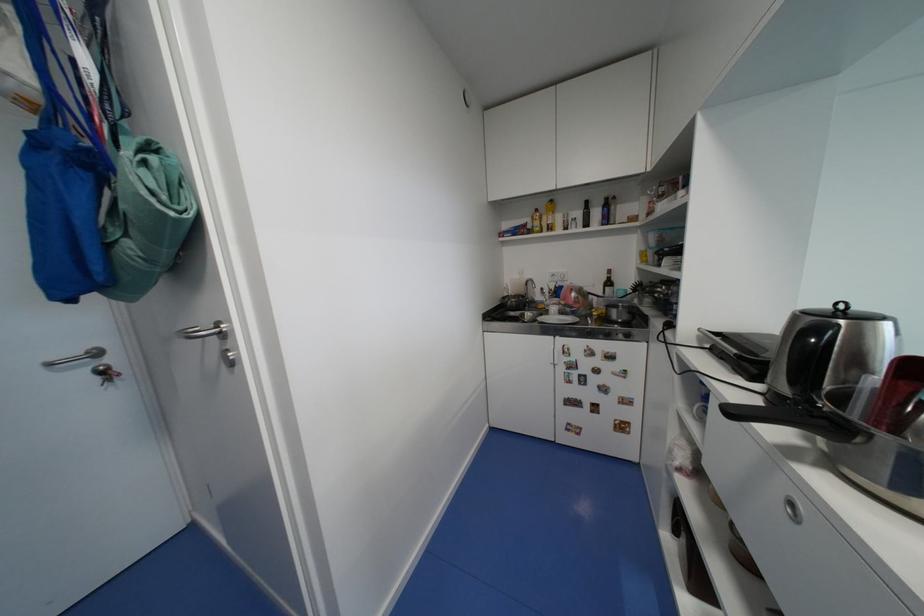
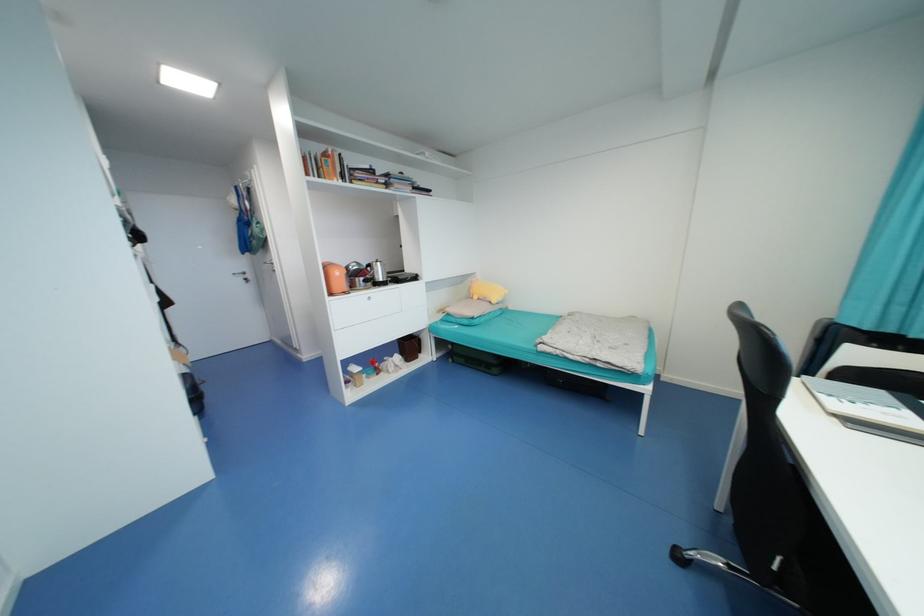
The point at (44, 145) is marked in the first image. Where is the corresponding point in the second image?

(244, 221)